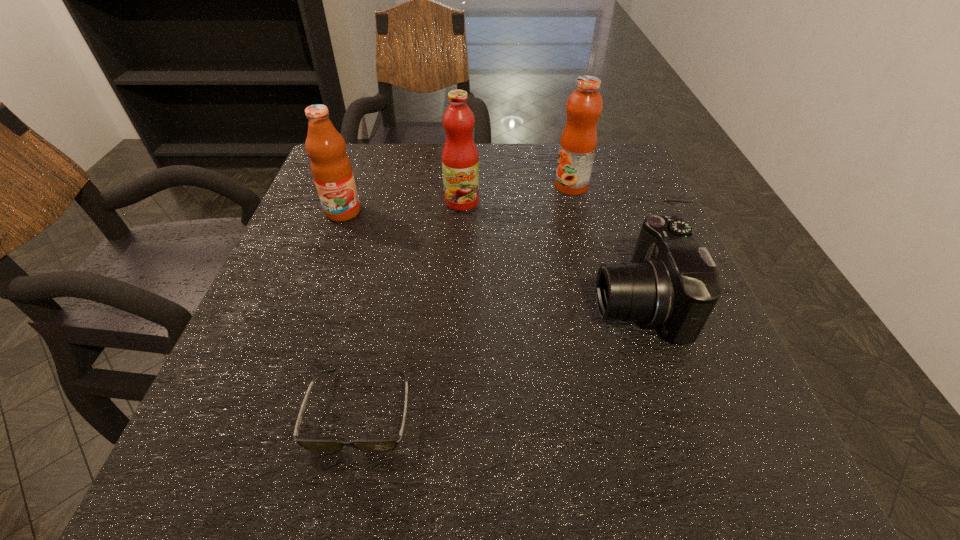
Locate which object is the second closest to the rightmost fruit juice. Please provide its 2D coordinates. Your answer should be formatted as a tuple, i.e. [(x, y)], where the tuple contains the x and y coordinates of a point satisfying the conditions above.

[(672, 282)]

Where is `the second closest fruit juice to the third object from left to right`? This screenshot has height=540, width=960. the second closest fruit juice to the third object from left to right is located at coordinates pyautogui.click(x=330, y=166).

Select which fruit juice appears as the third closest to the shortest object. Please provide its 2D coordinates. Your answer should be formatted as a tuple, i.e. [(x, y)], where the tuple contains the x and y coordinates of a point satisfying the conditions above.

[(578, 142)]

The height and width of the screenshot is (540, 960). I want to click on free location that satisfies the following two spatial constraints: 1. on the front label of the rightmost fruit juice; 2. on the front label of the leftmost object, so click(x=578, y=212).

This screenshot has width=960, height=540. Find the location of `vacant area in the image that satisfies the following two spatial constraints: 1. on the front label of the rightmost fruit juice; 2. on the front-facing side of the second object from left to right`. vacant area in the image that satisfies the following two spatial constraints: 1. on the front label of the rightmost fruit juice; 2. on the front-facing side of the second object from left to right is located at coordinates (629, 410).

Locate an element on the screen. free spot that satisfies the following two spatial constraints: 1. on the front label of the rightmost fruit juice; 2. on the front label of the leftmost object is located at coordinates (578, 212).

Identify the location of free location that satisfies the following two spatial constraints: 1. on the front label of the rightmost fruit juice; 2. on the front-facing side of the nearest object. This screenshot has width=960, height=540. (629, 410).